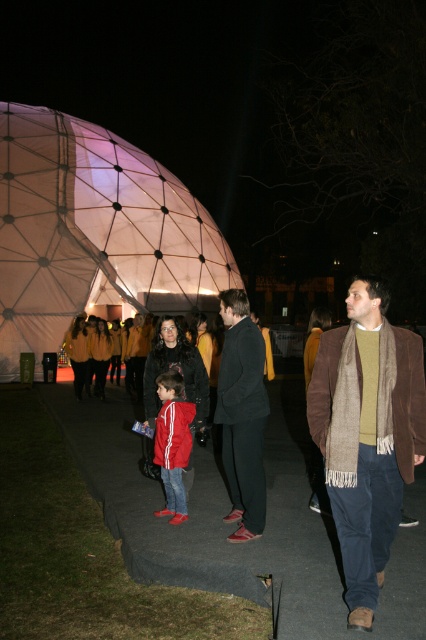
Question: Can you confirm if translucent fabric dome at center is wider than dark gray wool coat at center?

Choices:
 (A) yes
 (B) no

Answer: (A)

Question: Is the position of translucent fabric dome at center less distant than that of red matte jacket at center?

Choices:
 (A) yes
 (B) no

Answer: (B)

Question: Which point is closer to the camera?

Choices:
 (A) (245, 408)
 (B) (186, 461)

Answer: (A)

Question: Which point is closer to the camera taking this photo?

Choices:
 (A) (187, 440)
 (B) (141, 161)
 (C) (247, 304)
 (D) (380, 291)

Answer: (D)

Question: Among these objects, which one is farthest from the camera?

Choices:
 (A) dark gray wool coat at center
 (B) red matte jacket at center
 (C) brown woolen scarf at center

Answer: (B)

Question: Is translucent fabric dome at center positioned before dark gray wool coat at center?

Choices:
 (A) no
 (B) yes

Answer: (A)